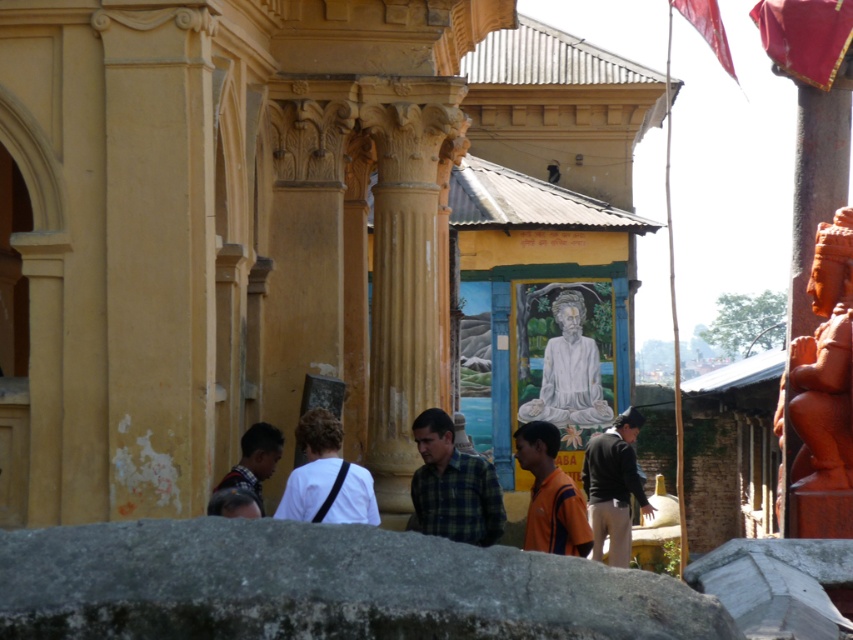
You are a visitor to the temple and want to place a small offering on the gray rough stone at lower center and the matte orange statue at right. Which surface will allow you to place a larger offering due to its size?

The gray rough stone at lower center has a larger width than the matte orange statue at right, so it can accommodate a larger offering.

From the picture: You are standing in front of the temple and see the white marble statue at center and the matte white shirt at center. Which object is closer to you?

The white marble statue at center is closer to you than the matte white shirt at center.

You are a tour guide leading a group to a temple. You want to ensure that your voice can be heard clearly by everyone. The statue and the shirt are both at the center. Given that human voice can carry up to 150 feet, can you stand by the white marble statue at center and be heard by those near the matte white shirt at center?

The distance between the white marble statue at center and the matte white shirt at center is 145.01 feet, which is just under the 150 feet limit. Therefore, your voice should carry sufficiently, allowing those near the matte white shirt at center to hear you clearly from the white marble statue at center.